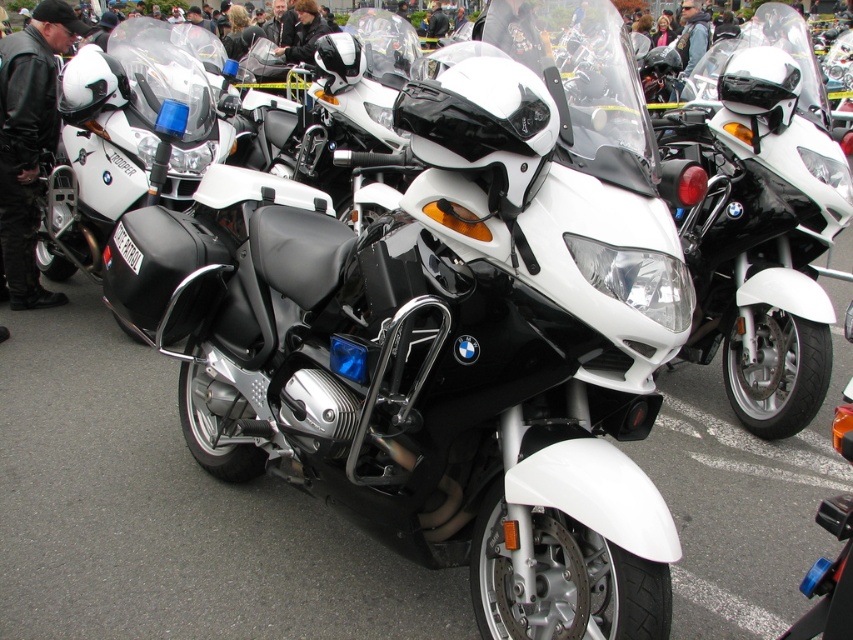
Question: Which object is closer to the camera taking this photo?

Choices:
 (A) black leather jacket at center
 (B) white matte/black textured motorcycle at center
 (C) white matte motorcycle at center

Answer: (B)

Question: Which object is positioned farthest from the leather jacket at center?

Choices:
 (A) black leather jacket at center
 (B) white matte motorcycle at center
 (C) white matte/black textured motorcycle at center

Answer: (B)

Question: Can you confirm if white matte motorcycle at center is smaller than black leather jacket at center?

Choices:
 (A) yes
 (B) no

Answer: (B)

Question: Is white matte motorcycle at center behind black leather jacket at center?

Choices:
 (A) yes
 (B) no

Answer: (B)

Question: Which of the following is the farthest from the observer?

Choices:
 (A) leather jacket at center
 (B) white matte motorcycle at center
 (C) black leather jacket at center

Answer: (C)

Question: Does white matte/black textured motorcycle at center come behind white matte motorcycle at center?

Choices:
 (A) yes
 (B) no

Answer: (B)